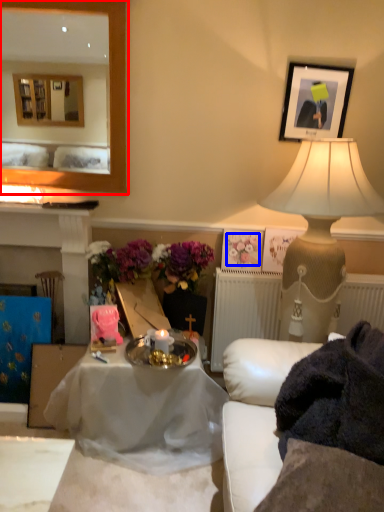
Question: Among these objects, which one is nearest to the camera, mirror (highlighted by a red box) or flower (highlighted by a blue box)?

Choices:
 (A) mirror
 (B) flower

Answer: (A)